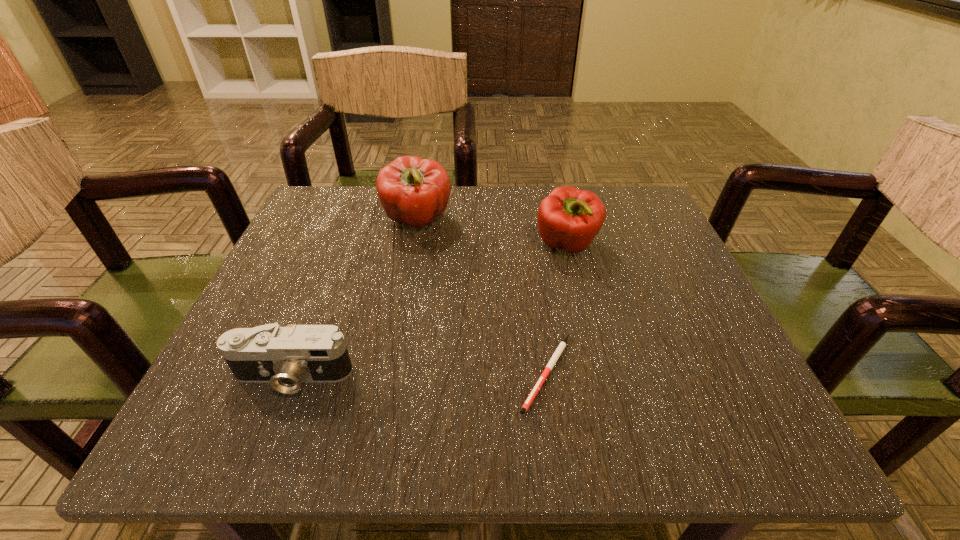
This screenshot has width=960, height=540. I want to click on the left bell pepper, so click(414, 191).

Identify the location of the right bell pepper. The height and width of the screenshot is (540, 960). (568, 218).

The height and width of the screenshot is (540, 960). I want to click on the shorter bell pepper, so click(568, 218).

Find the location of a particular element. Image resolution: width=960 pixels, height=540 pixels. the third tallest object is located at coordinates (285, 357).

Find the location of a particular element. the shortest object is located at coordinates (562, 345).

Where is `vacant space situated 0.100m on the left of the left bell pepper`? This screenshot has height=540, width=960. vacant space situated 0.100m on the left of the left bell pepper is located at coordinates (335, 221).

You are a GUI agent. You are given a task and a screenshot of the screen. Output one action in this format:
    pyautogui.click(x=<x>, y=<y>)
    Task: Click on the free space located on the left of the second tallest object
    This screenshot has width=960, height=540.
    Given the screenshot: What is the action you would take?
    pyautogui.click(x=393, y=245)

This screenshot has width=960, height=540. I want to click on vacant region located on the lens of the camera, so click(x=271, y=433).

Where is `camera at the near edge`? This screenshot has height=540, width=960. camera at the near edge is located at coordinates (285, 357).

Locate an element on the screen. Image resolution: width=960 pixels, height=540 pixels. pen that is at the near edge is located at coordinates (562, 345).